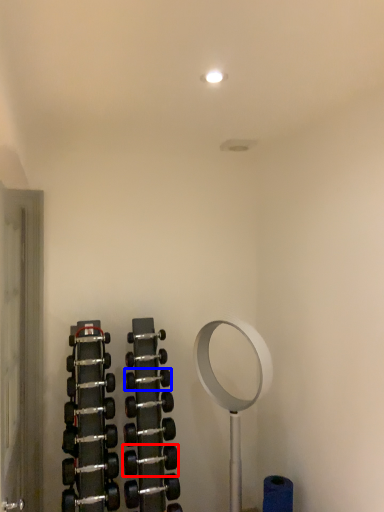
Question: Which object is closer to the camera taking this photo, dumbbell (highlighted by a red box) or dumbbell (highlighted by a blue box)?

Choices:
 (A) dumbbell
 (B) dumbbell

Answer: (A)